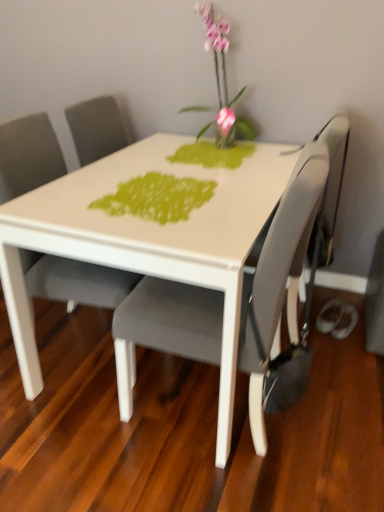
You are a GUI agent. You are given a task and a screenshot of the screen. Output one action in this format:
    pyautogui.click(x=<x>, y=<y>)
    Task: Click on the vacant region to the left of green textured placemat at center
    
    Given the screenshot: What is the action you would take?
    pyautogui.click(x=72, y=193)